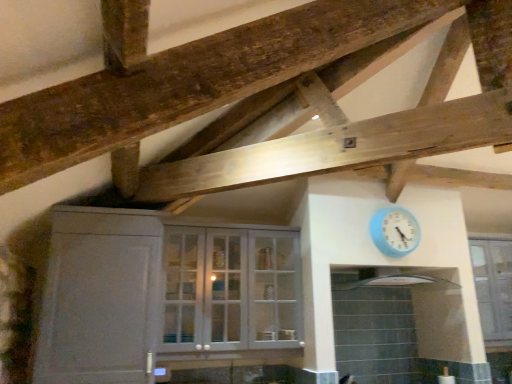
Question: In terms of size, does white glossy cabinet at center appear bigger or smaller than white glossy exhaust hood at upper center?

Choices:
 (A) small
 (B) big

Answer: (B)

Question: From the image's perspective, relative to white glossy exhaust hood at upper center, is white glossy cabinet at center above or below?

Choices:
 (A) below
 (B) above

Answer: (A)

Question: Which of these objects is positioned farthest from the light blue plastic wall clock at upper right?

Choices:
 (A) clear glass cabinet at upper center
 (B) white matte cabinet at left
 (C) white glossy exhaust hood at upper center
 (D) white glossy cabinet at center

Answer: (B)

Question: Which object is the farthest from the clear glass cabinet at upper center?

Choices:
 (A) light blue plastic wall clock at upper right
 (B) white matte cabinet at left
 (C) white glossy cabinet at center
 (D) white glossy exhaust hood at upper center

Answer: (B)